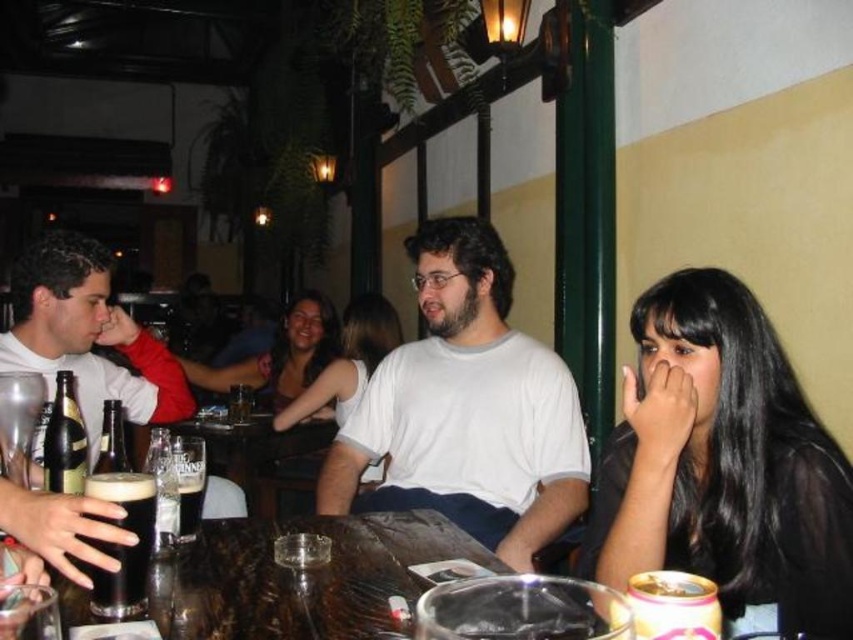
Question: Considering the real-world distances, which object is closest to the black hair at right?

Choices:
 (A) white matte shirt at center
 (B) gold metallic can at lower right

Answer: (B)

Question: Which object is the closest to the gold metallic can at lower right?

Choices:
 (A) smooth white tank top at center
 (B) dark matte glass at table center

Answer: (B)

Question: Is matte black dress at center thinner than dark matte glass at table center?

Choices:
 (A) no
 (B) yes

Answer: (A)

Question: Is the position of translucent glass beer at center more distant than that of smooth white tank top at center?

Choices:
 (A) yes
 (B) no

Answer: (B)

Question: Among these objects, which one is nearest to the camera?

Choices:
 (A) translucent glass beer at center
 (B) black hair at right
 (C) matte black dress at center
 (D) dark matte glass at table center

Answer: (B)

Question: Is matte black shirt at left below dark matte glass at table center?

Choices:
 (A) yes
 (B) no

Answer: (B)